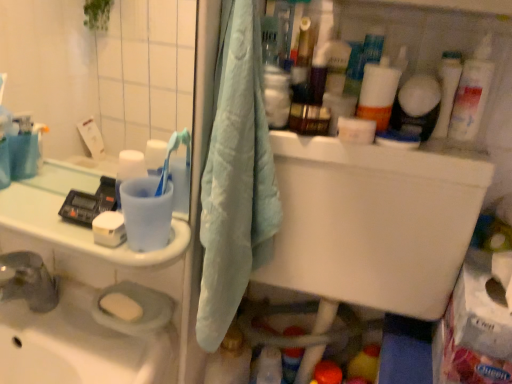
Question: From a real-world perspective, does light blue fabric towel at center sit lower than white glossy cup at left?

Choices:
 (A) yes
 (B) no

Answer: (B)

Question: Is light blue fabric towel at center taller than white glossy cup at left?

Choices:
 (A) yes
 (B) no

Answer: (A)

Question: Would you say white glossy cup at left is part of light blue fabric towel at center's contents?

Choices:
 (A) yes
 (B) no

Answer: (B)

Question: Is light blue fabric towel at center positioned in front of white glossy cup at left?

Choices:
 (A) yes
 (B) no

Answer: (A)

Question: Is light blue fabric towel at center wider than white glossy cup at left?

Choices:
 (A) yes
 (B) no

Answer: (A)

Question: Based on their positions, is translucent plastic bottle at lower center, marked as the 3th cleaning product in a right-to-left arrangement, located to the left or right of translucent plastic bottle at upper right, marked as the second cleaning product in a left-to-right arrangement?

Choices:
 (A) right
 (B) left

Answer: (B)

Question: From the image's perspective, relative to translucent plastic bottle at upper right, which is counted as the 2th cleaning product, starting from the right, is translucent plastic bottle at lower center, which ranks as the third cleaning product in top-to-bottom order, above or below?

Choices:
 (A) above
 (B) below

Answer: (B)

Question: Considering the positions of translucent plastic bottle at lower center, positioned as the first cleaning product in left-to-right order, and translucent plastic bottle at upper right, which is counted as the 2th cleaning product, starting from the right, in the image, is translucent plastic bottle at lower center, positioned as the first cleaning product in left-to-right order, bigger or smaller than translucent plastic bottle at upper right, which is counted as the 2th cleaning product, starting from the right,?

Choices:
 (A) small
 (B) big

Answer: (B)

Question: Considering their positions, is translucent plastic bottle at lower center, which ranks as the third cleaning product in top-to-bottom order, located in front of or behind translucent plastic bottle at upper right, marked as the second cleaning product in a left-to-right arrangement?

Choices:
 (A) front
 (B) behind

Answer: (B)

Question: Considering the positions of translucent plastic bottle at upper right, marked as the second cleaning product in a left-to-right arrangement, and translucent plastic bottle at lower center, positioned as the first cleaning product in left-to-right order, in the image, is translucent plastic bottle at upper right, marked as the second cleaning product in a left-to-right arrangement, taller or shorter than translucent plastic bottle at lower center, positioned as the first cleaning product in left-to-right order,?

Choices:
 (A) tall
 (B) short

Answer: (B)

Question: From the image's perspective, is translucent plastic bottle at upper right, the second cleaning product positioned from the bottom, located above or below translucent plastic bottle at lower center, which ranks as the third cleaning product in top-to-bottom order?

Choices:
 (A) below
 (B) above

Answer: (B)

Question: Based on their sizes in the image, would you say translucent plastic bottle at upper right, the second cleaning product positioned from the bottom, is bigger or smaller than translucent plastic bottle at lower center, placed as the first cleaning product when sorted from bottom to top?

Choices:
 (A) small
 (B) big

Answer: (A)

Question: Relative to translucent plastic bottle at lower center, positioned as the first cleaning product in left-to-right order, is translucent plastic bottle at upper right, placed as the 2th cleaning product when sorted from top to bottom, in front or behind?

Choices:
 (A) front
 (B) behind

Answer: (A)

Question: In terms of width, does white glossy cup at left look wider or thinner when compared to white plastic tube at upper right?

Choices:
 (A) wide
 (B) thin

Answer: (A)

Question: From the image's perspective, is white glossy cup at left above or below white plastic tube at upper right?

Choices:
 (A) below
 (B) above

Answer: (A)